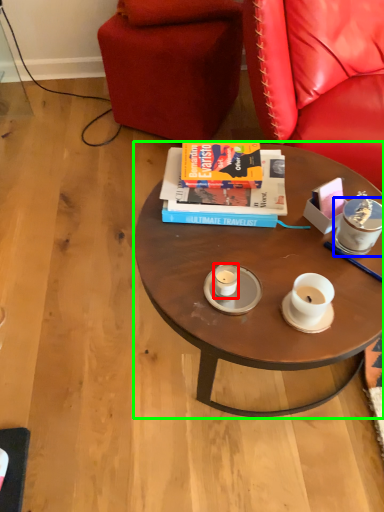
Question: Which object is the farthest from coffee cup (highlighted by a red box)? Choose among these: coffee cup (highlighted by a blue box) or coffee table (highlighted by a green box).

Choices:
 (A) coffee cup
 (B) coffee table

Answer: (A)